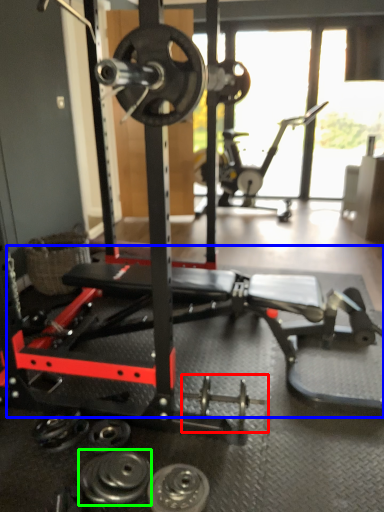
Question: Considering the real-world distances, which object is farthest from dumbbell (highlighted by a red box)? training bench (highlighted by a blue box) or dumbbell (highlighted by a green box)?

Choices:
 (A) training bench
 (B) dumbbell

Answer: (A)